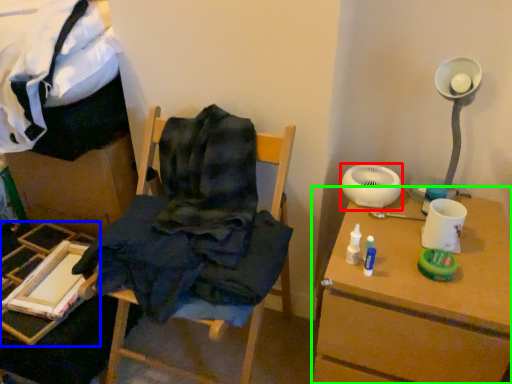
Question: Which object is the closest to the mechanical fan (highlighted by a red box)? Choose among these: furniture (highlighted by a blue box) or table (highlighted by a green box).

Choices:
 (A) furniture
 (B) table

Answer: (B)